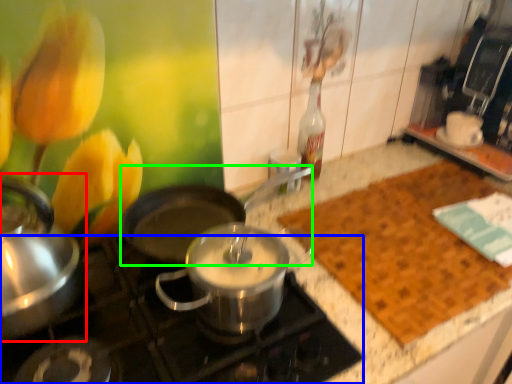
Question: Which object is positioned closest to kitchen appliance (highlighted by a red box)? Select from gas stove (highlighted by a blue box) and wok (highlighted by a green box).

Choices:
 (A) gas stove
 (B) wok

Answer: (A)